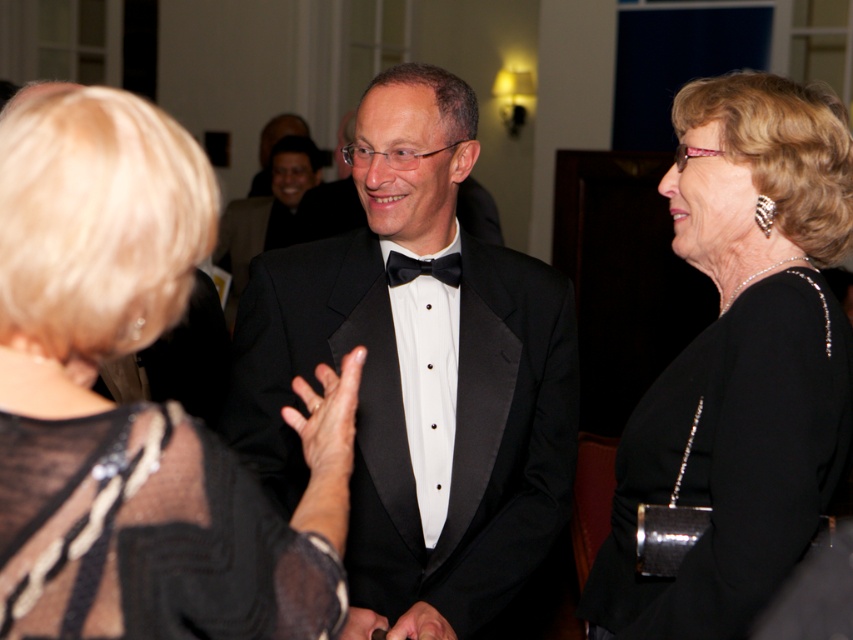
Question: Which point is closer to the camera?

Choices:
 (A) black satin dress at right
 (B) black lace dress at center
 (C) black satin tuxedo at center
 (D) black satin bow tie at center

Answer: (B)

Question: Which of the following is the closest to the observer?

Choices:
 (A) (x=294, y=273)
 (B) (x=151, y=189)

Answer: (B)

Question: Is black satin tuxedo at center positioned behind black sheer fabric dress at lower left?

Choices:
 (A) no
 (B) yes

Answer: (B)

Question: Which of the following is the farthest from the observer?

Choices:
 (A) (84, 468)
 (B) (567, 413)

Answer: (B)

Question: Does black satin tuxedo at center lie in front of black sheer fabric dress at lower left?

Choices:
 (A) no
 (B) yes

Answer: (A)

Question: Is black lace dress at center thinner than black satin dress at right?

Choices:
 (A) no
 (B) yes

Answer: (B)